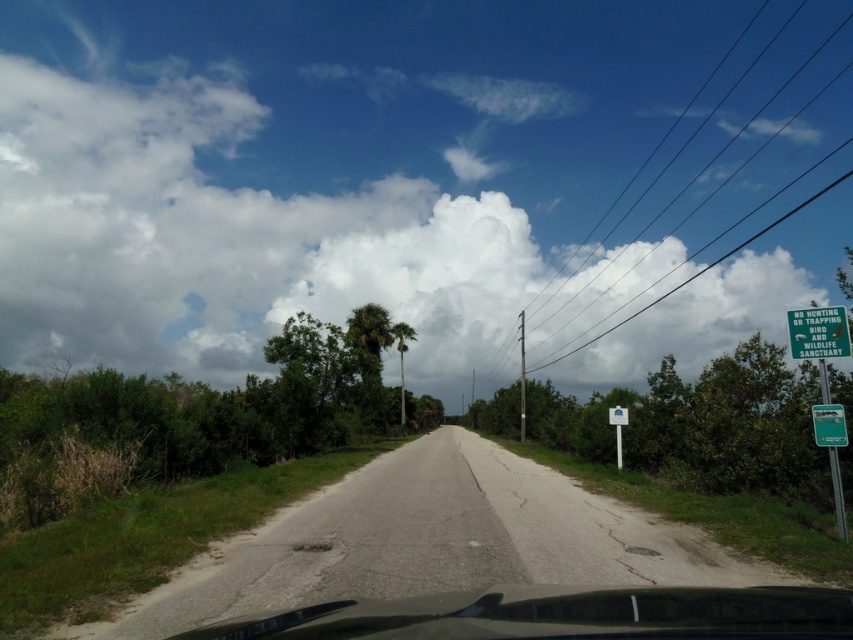
Question: Which of the following is the farthest from the observer?

Choices:
 (A) (828, 333)
 (B) (627, 419)

Answer: (B)

Question: Is the position of black wire at upper right more distant than that of black glossy car at center?

Choices:
 (A) yes
 (B) no

Answer: (A)

Question: Considering the relative positions of green plastic sign at upper right and blue plastic sign at center-right in the image provided, where is green plastic sign at upper right located with respect to blue plastic sign at center-right?

Choices:
 (A) left
 (B) right

Answer: (A)

Question: Which object is closer to the camera taking this photo?

Choices:
 (A) black glossy car at center
 (B) blue plastic sign at center-right
 (C) green plastic sign at upper right

Answer: (A)

Question: Can you confirm if black glossy car at center is smaller than blue plastic sign at center-right?

Choices:
 (A) no
 (B) yes

Answer: (A)

Question: Which object is positioned farthest from the white fluffy cloud at upper center?

Choices:
 (A) green plastic sign at upper right
 (B) blue plastic sign at center-right
 (C) green plastic sign at right

Answer: (A)